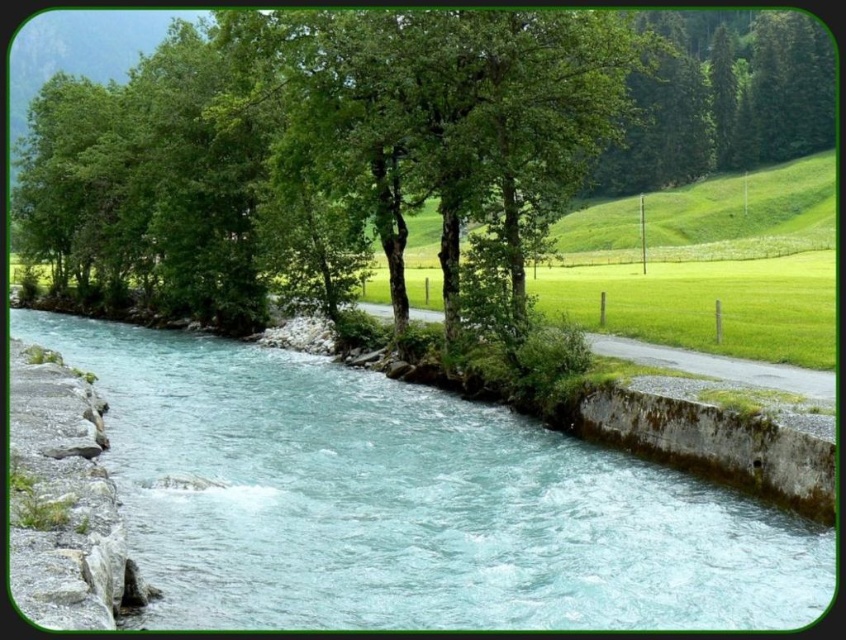
You are standing at the edge of the river and want to take a photo of both point (673, 552) and point (750, 202). Which point should you focus on first to ensure both are in the frame?

You should focus on point (673, 552) first because it is closer to the camera than point (750, 202), ensuring both points are within the frame.

You are a photographer planning to capture the flowing river and the tree in the background. Based on the scene, which object between the clear water at center and the green leafy tree at upper center would you focus on if you want to highlight something narrower in your composition?

The clear water at center is thinner than the green leafy tree at upper center, so focusing on the clear water at center would highlight the narrower element in the composition.